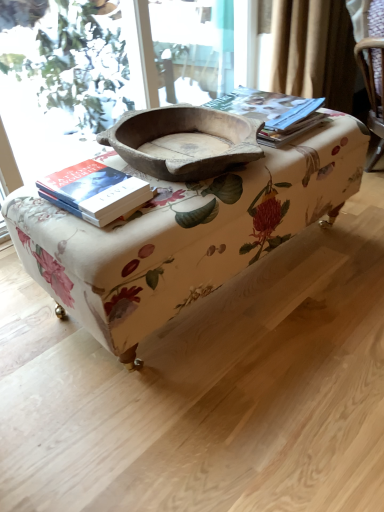
You are a GUI agent. You are given a task and a screenshot of the screen. Output one action in this format:
    pyautogui.click(x=<x>, y=<y>)
    Task: Click on the matte paper at upper right
    Image resolution: width=384 pixels, height=512 pixels.
    Given the screenshot: What is the action you would take?
    pyautogui.click(x=272, y=113)

Measure the distance between point (82,203) and camera.

85.40 centimeters.

Describe the element at coordinates (183, 233) in the screenshot. I see `floral fabric ottoman at center` at that location.

The height and width of the screenshot is (512, 384). I want to click on natural wood bowl at center, so click(184, 141).

Is matte paper at upper right thinner than natural wood bowl at center?

Indeed, matte paper at upper right has a lesser width compared to natural wood bowl at center.

Does matte paper at upper right have a larger size compared to natural wood bowl at center?

No, matte paper at upper right is not bigger than natural wood bowl at center.

Would you say matte paper at upper right is a long distance from natural wood bowl at center?

No, matte paper at upper right is not far away from natural wood bowl at center.

Which of these two, matte paper at upper right or floral fabric ottoman at center, stands shorter?

With less height is matte paper at upper right.

Which object is closer to the camera taking this photo, matte paper at upper right or floral fabric ottoman at center?

floral fabric ottoman at center is in front.

Does point (279, 105) come farther from viewer compared to point (251, 249)?

Yes, it is behind point (251, 249).

Would you say matte paper at upper right contains floral fabric ottoman at center?

Definitely not — floral fabric ottoman at center is not inside matte paper at upper right.

Considering the relative positions of floral fabric ottoman at center and hardcover book at left in the image provided, is floral fabric ottoman at center to the left of hardcover book at left from the viewer's perspective?

Incorrect, floral fabric ottoman at center is not on the left side of hardcover book at left.

From a real-world perspective, is floral fabric ottoman at center located beneath hardcover book at left?

Correct, in the physical world, floral fabric ottoman at center is lower than hardcover book at left.

Can you confirm if floral fabric ottoman at center is taller than hardcover book at left?

Yes.

Is floral fabric ottoman at center oriented away from hardcover book at left?

No, floral fabric ottoman at center is not facing the opposite direction of hardcover book at left.

Does matte paper at upper right have a lesser height compared to hardcover book at left?

In fact, matte paper at upper right may be taller than hardcover book at left.

Is matte paper at upper right wider or thinner than hardcover book at left?

matte paper at upper right is wider than hardcover book at left.

Which point is more distant from viewer, (248, 101) or (122, 184)?

A: The point (248, 101) is farther.

From the image's perspective, is matte paper at upper right under hardcover book at left?

No.

Is hardcover book at left closer to camera compared to matte paper at upper right?

Yes, the depth of hardcover book at left is less than that of matte paper at upper right.

Considering the points (93, 192) and (292, 109), which point is in front, point (93, 192) or point (292, 109)?

Positioned in front is point (93, 192).

Between hardcover book at left and matte paper at upper right, which one appears on the right side from the viewer's perspective?

From the viewer's perspective, matte paper at upper right appears more on the right side.

The height and width of the screenshot is (512, 384). Identify the location of paperback book above the hardcover book at left (from a real-world perspective). (272, 113).

How distant is natural wood bowl at center from floral fabric ottoman at center?

natural wood bowl at center is 7.01 inches from floral fabric ottoman at center.

Which is more to the right, natural wood bowl at center or floral fabric ottoman at center?

floral fabric ottoman at center.

In terms of height, does natural wood bowl at center look taller or shorter compared to floral fabric ottoman at center?

In the image, natural wood bowl at center appears to be shorter than floral fabric ottoman at center.

Does natural wood bowl at center come behind floral fabric ottoman at center?

Yes, it is.

Can you confirm if natural wood bowl at center is smaller than matte paper at upper right?

No, natural wood bowl at center is not smaller than matte paper at upper right.

Is natural wood bowl at center next to matte paper at upper right?

No, natural wood bowl at center is not in contact with matte paper at upper right.

What's the angular difference between natural wood bowl at center and matte paper at upper right's facing directions?

The facing directions of natural wood bowl at center and matte paper at upper right are 5.31 degrees apart.

Is point (148, 159) positioned in front of point (284, 113)?

Yes, it is in front of point (284, 113).

This screenshot has height=512, width=384. What are the coordinates of `paperback book lying on the right of natural wood bowl at center` in the screenshot? It's located at (272, 113).

Locate an element on the screen. The width and height of the screenshot is (384, 512). table that is on the left side of matte paper at upper right is located at coordinates (183, 233).

Looking at the image, which one is located further to matte paper at upper right, floral fabric ottoman at center or hardcover book at left?

hardcover book at left is positioned further to the anchor matte paper at upper right.

From the image, which object appears to be farther from natural wood bowl at center, matte paper at upper right or hardcover book at left?

Based on the image, matte paper at upper right appears to be further to natural wood bowl at center.

Looking at the image, which one is located closer to natural wood bowl at center, hardcover book at left or floral fabric ottoman at center?

Based on the image, hardcover book at left appears to be nearer to natural wood bowl at center.

Based on their spatial positions, is floral fabric ottoman at center or natural wood bowl at center further from matte paper at upper right?

floral fabric ottoman at center.

When comparing their distances from natural wood bowl at center, does floral fabric ottoman at center or matte paper at upper right seem closer?

Among the two, matte paper at upper right is located nearer to natural wood bowl at center.

From the image, which object appears to be nearer to natural wood bowl at center, matte paper at upper right or floral fabric ottoman at center?

Based on the image, matte paper at upper right appears to be nearer to natural wood bowl at center.

When comparing their distances from matte paper at upper right, does hardcover book at left or floral fabric ottoman at center seem closer?

Based on the image, floral fabric ottoman at center appears to be nearer to matte paper at upper right.

Looking at the image, which one is located further to floral fabric ottoman at center, natural wood bowl at center or hardcover book at left?

Among the two, hardcover book at left is located further to floral fabric ottoman at center.

Locate an element on the screen. The width and height of the screenshot is (384, 512). table located between hardcover book at left and matte paper at upper right in the left-right direction is located at coordinates (183, 233).

This screenshot has width=384, height=512. I want to click on bowl positioned between floral fabric ottoman at center and matte paper at upper right from near to far, so click(184, 141).

I want to click on bowl between hardcover book at left and matte paper at upper right, so pos(184,141).

This screenshot has width=384, height=512. I want to click on bowl located between hardcover book at left and floral fabric ottoman at center in the left-right direction, so click(x=184, y=141).